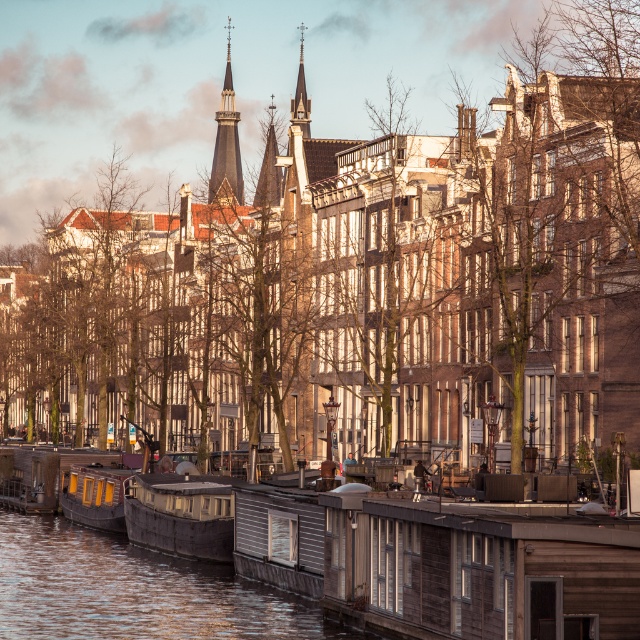
What is located at the coordinates point (180, 515) in the image?

The point (180, 515) indicates a wooden boat at center.

You are standing on the dock and see a point marked at coordinates [93,497]. Which object does this point belong to?

The point at coordinates [93,497] belongs to the wooden cabin boat at lower left.

You are an architect analyzing the canal scene. You need to determine the spatial relationship between the dark brown wooden spire at upper center and the smooth gray spire at center. Which spire is located above the other?

The dark brown wooden spire at upper center is positioned over smooth gray spire at center, meaning it is above the other.